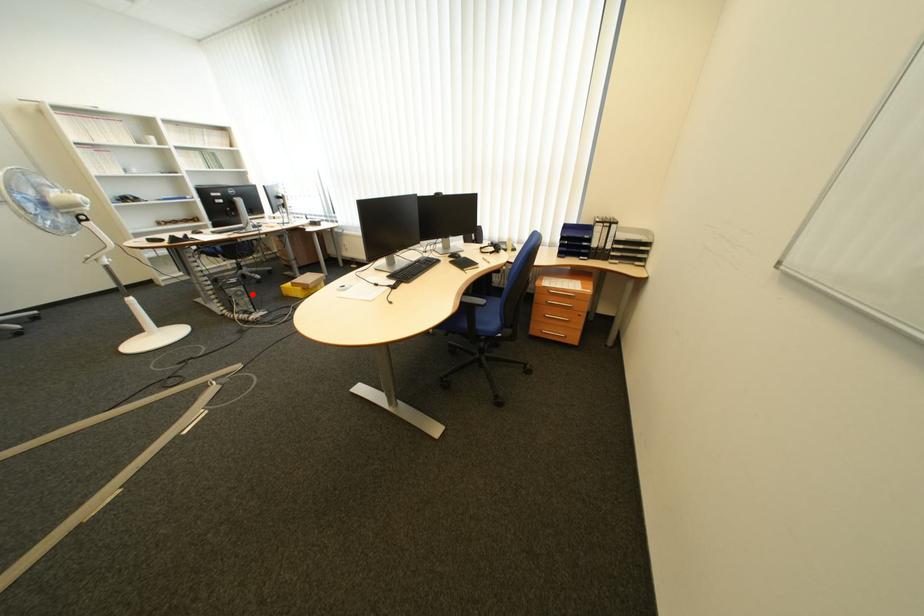
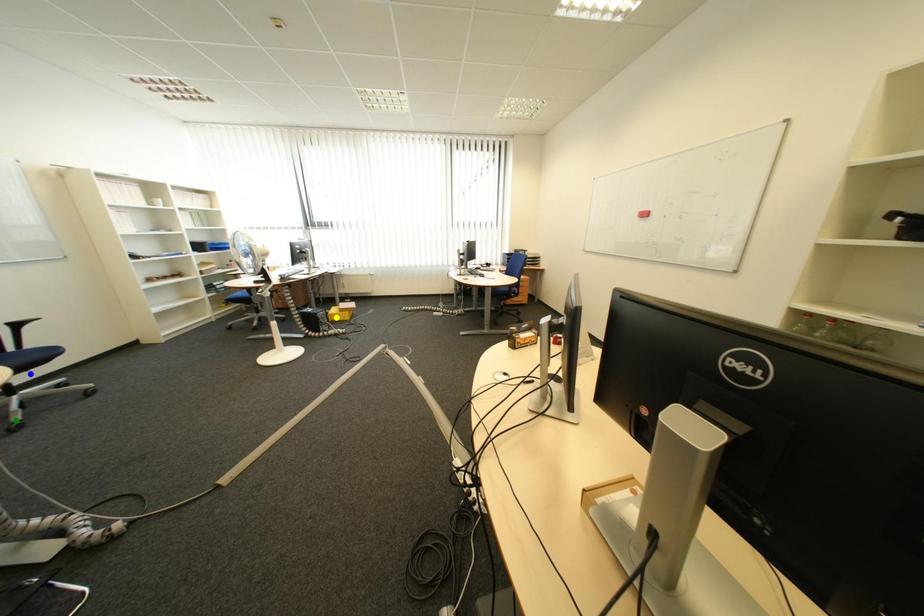
Question: I am providing you with two images of the same scene from different viewpoints. A red point is marked on the first image. You are given multiple points on the second image. Which spot in image 2 lines up with the point in image 1?

Choices:
 (A) green point
 (B) blue point
 (C) yellow point

Answer: (C)